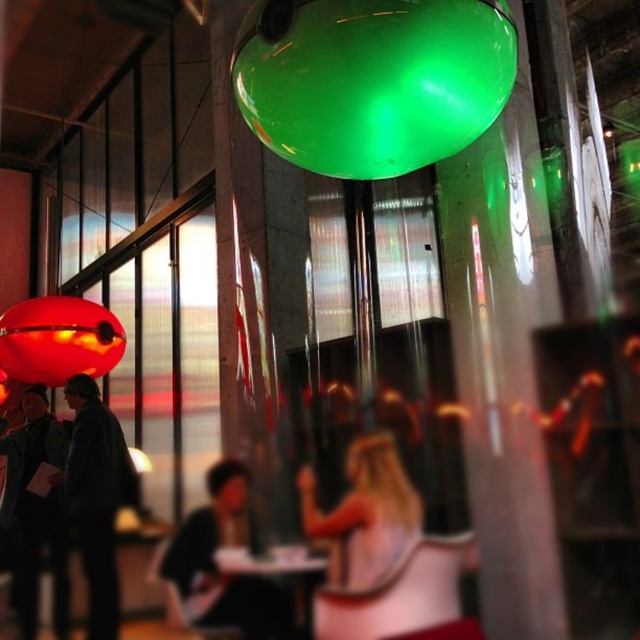
Does green translucent sphere at upper center have a greater height compared to matte red balloon at left?

No.

Between point (451, 88) and point (52, 360), which one is positioned behind?

Point (52, 360)

Between point (497, 65) and point (106, 356), which one is positioned in front?

Point (497, 65)

Find the location of `green translucent sphere at upper center`. green translucent sphere at upper center is located at coordinates (372, 80).

Between point (353, 112) and point (356, 509), which one is positioned behind?

Point (356, 509)

Is point (346, 120) positioned after point (365, 538)?

No.

Locate an element on the screen. The image size is (640, 640). green translucent sphere at upper center is located at coordinates (372, 80).

From the picture: Is dark gray jacket at lower left taller than matte red balloon at left?

Correct, dark gray jacket at lower left is much taller as matte red balloon at left.

Does dark gray jacket at lower left have a lesser height compared to matte red balloon at left?

No, dark gray jacket at lower left is not shorter than matte red balloon at left.

Who is more forward, (58, 467) or (49, 323)?

Point (49, 323) is more forward.

The image size is (640, 640). In order to click on dark gray jacket at lower left in this screenshot , I will do `click(36, 513)`.